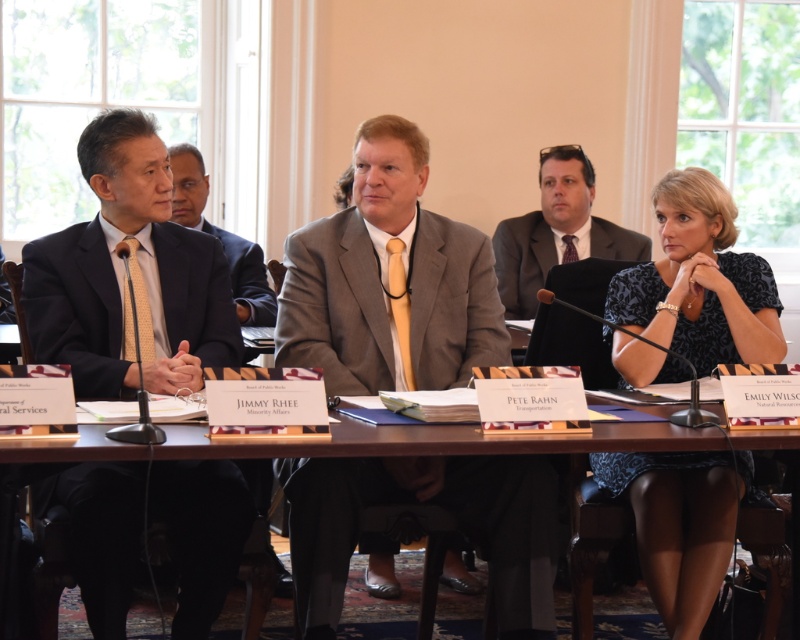
In the scene shown: How distant is dark blue suit at left from matte gray suit at center?

dark blue suit at left and matte gray suit at center are 6.56 feet apart.

Between point (214, 605) and point (516, 221), which one is positioned behind?

Point (516, 221)

At what (x,y) coordinates should I click in order to perform the action: click on dark blue suit at left. Please return your answer as a coordinate pair (x, y). Image resolution: width=800 pixels, height=640 pixels. Looking at the image, I should click on (76, 307).

Which is above, dark blue suit at left or brown wooden table at center?

Positioned higher is dark blue suit at left.

Is point (90, 540) closer to viewer compared to point (566, 442)?

No, it is behind (566, 442).

The width and height of the screenshot is (800, 640). I want to click on dark blue suit at left, so click(76, 307).

Measure the distance between blue dotted blouse at center and camera.

blue dotted blouse at center is 3.19 meters from camera.

Is point (636, 276) positioned behind point (514, 221)?

No, (636, 276) is in front of (514, 221).

Is point (652, 480) positioned in front of point (524, 292)?

Yes, point (652, 480) is closer to viewer.

What are the coordinates of `blue dotted blouse at center` in the screenshot? It's located at (694, 291).